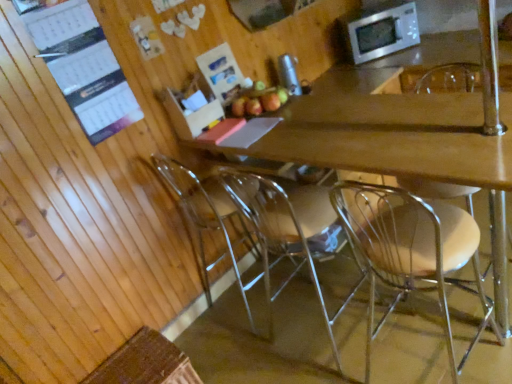
The image size is (512, 384). I want to click on white paper calendar at upper left, so click(81, 65).

This screenshot has height=384, width=512. What do you see at coordinates (396, 139) in the screenshot? I see `wooden desk at center` at bounding box center [396, 139].

You are a GUI agent. You are given a task and a screenshot of the screen. Output one action in this format:
    pyautogui.click(x=<x>, y=<y>)
    Task: Click on the red matte apple at center
    The width and height of the screenshot is (512, 384).
    Given the screenshot: What is the action you would take?
    pyautogui.click(x=258, y=100)

The image size is (512, 384). Describe the element at coordinates (209, 221) in the screenshot. I see `clear plastic chair at lower center, the 4th chair when ordered from right to left` at that location.

Find the location of a particular element. Image resolution: width=512 pixels, height=384 pixels. stainless steel microwave at upper right is located at coordinates (382, 30).

Considering the relative sizes of white paper calendar at upper left and stainless steel microwave at upper right in the image provided, is white paper calendar at upper left shorter than stainless steel microwave at upper right?

Incorrect, the height of white paper calendar at upper left does not fall short of that of stainless steel microwave at upper right.

Considering the sizes of objects white paper calendar at upper left and stainless steel microwave at upper right in the image provided, who is thinner, white paper calendar at upper left or stainless steel microwave at upper right?

white paper calendar at upper left is thinner.

Is white paper calendar at upper left bigger than stainless steel microwave at upper right?

No.

From a real-world perspective, which is physically below, white paper calendar at upper left or stainless steel microwave at upper right?

stainless steel microwave at upper right is physically lower.

From a real-world perspective, between red matte apple at center and clear plastic chair at lower center, the 4th chair when ordered from right to left, who is vertically higher?

From a 3D spatial view, red matte apple at center is above.

Looking at this image, can you confirm if red matte apple at center is positioned to the left of clear plastic chair at lower center, the 4th chair when ordered from right to left?

Incorrect, red matte apple at center is not on the left side of clear plastic chair at lower center, the 4th chair when ordered from right to left.

Between red matte apple at center and clear plastic chair at lower center, the 4th chair when ordered from right to left, which one is positioned in front?

Positioned in front is clear plastic chair at lower center, the 4th chair when ordered from right to left.

Does clear plastic chair at center, the second chair in the right-to-left sequence, have a larger size compared to wooden desk at center?

Incorrect, clear plastic chair at center, the second chair in the right-to-left sequence, is not larger than wooden desk at center.

Are clear plastic chair at center, arranged as the 3th chair when viewed from the left, and wooden desk at center far apart?

No.

From a real-world perspective, between clear plastic chair at center, the second chair in the right-to-left sequence, and wooden desk at center, who is vertically lower?

wooden desk at center, from a real-world perspective.

Is point (457, 213) closer to camera compared to point (495, 156)?

No, (457, 213) is behind (495, 156).

Is stainless steel microwave at upper right not near clear plastic chair at center, which is the 4th chair from left to right?

No, stainless steel microwave at upper right is not far away from clear plastic chair at center, which is the 4th chair from left to right.

Does stainless steel microwave at upper right appear on the right side of clear plastic chair at center, which is the 4th chair from left to right?

No.

The height and width of the screenshot is (384, 512). In order to click on microwave oven above the clear plastic chair at center, which is the 4th chair from left to right (from a real-world perspective) in this screenshot , I will do point(382,30).

How different are the orientations of stainless steel microwave at upper right and clear plastic chair at center, the 1th chair from the right, in degrees?

The facing directions of stainless steel microwave at upper right and clear plastic chair at center, the 1th chair from the right, are 47 degrees apart.

Identify the location of the 1st chair counting from the right of the wooden desk at center. Image resolution: width=512 pixels, height=384 pixels. (411, 252).

Would you say clear plastic chair at center, the second chair in the right-to-left sequence, is part of wooden desk at center's contents?

Absolutely, clear plastic chair at center, the second chair in the right-to-left sequence, is inside wooden desk at center.

Could you measure the distance between wooden desk at center and clear plastic chair at center, the second chair in the right-to-left sequence?

They are 12.07 inches apart.

From the image's perspective, which object appears higher, wooden desk at center or clear plastic chair at center, the second chair in the right-to-left sequence?

From the image's view, wooden desk at center is above.

Does white paper calendar at upper left have a greater height compared to wooden desk at center?

No, white paper calendar at upper left is not taller than wooden desk at center.

From the image's perspective, is white paper calendar at upper left located beneath wooden desk at center?

No, from the image's perspective, white paper calendar at upper left is not beneath wooden desk at center.

Can you confirm if white paper calendar at upper left is thinner than wooden desk at center?

Yes, white paper calendar at upper left is thinner than wooden desk at center.

Is white paper calendar at upper left aimed at wooden desk at center?

No, white paper calendar at upper left is not facing towards wooden desk at center.

Where is `the 3rd chair in front when counting from the red matte apple at center`? the 3rd chair in front when counting from the red matte apple at center is located at coordinates (450, 79).

How many degrees apart are the facing directions of red matte apple at center and clear plastic chair at center, the 1th chair from the right?

The angular difference between red matte apple at center and clear plastic chair at center, the 1th chair from the right, is 89.2 degrees.

Based on the photo, is red matte apple at center wider or thinner than clear plastic chair at center, which is the 4th chair from left to right?

In the image, red matte apple at center appears to be more narrow than clear plastic chair at center, which is the 4th chair from left to right.

Is red matte apple at center in front of clear plastic chair at center, the 1th chair from the right?

No, it is behind clear plastic chair at center, the 1th chair from the right.

In order to click on bulletin board on the left of stainless steel microwave at upper right in this screenshot , I will do `click(81, 65)`.

Image resolution: width=512 pixels, height=384 pixels. Find the location of `apple positioned vertically above the clear plastic chair at lower center, which appears as the first chair when viewed from the left (from a real-world perspective)`. apple positioned vertically above the clear plastic chair at lower center, which appears as the first chair when viewed from the left (from a real-world perspective) is located at coordinates (258, 100).

Looking at the image, which one is located closer to clear acrylic chair at center, acting as the second chair starting from the left, wooden desk at center or clear plastic chair at lower center, which appears as the first chair when viewed from the left?

clear plastic chair at lower center, which appears as the first chair when viewed from the left, is closer to clear acrylic chair at center, acting as the second chair starting from the left.

Looking at this image, looking at the image, which one is located further to clear plastic chair at center, the 1th chair from the right, wooden desk at center or white paper calendar at upper left?

white paper calendar at upper left is positioned further to the anchor clear plastic chair at center, the 1th chair from the right.

From the image, which object appears to be farther from clear acrylic chair at center, arranged as the third chair when viewed from the right, stainless steel microwave at upper right or wooden desk at center?

The object further to clear acrylic chair at center, arranged as the third chair when viewed from the right, is stainless steel microwave at upper right.

Estimate the real-world distances between objects in this image. Which object is closer to clear plastic chair at lower center, which appears as the first chair when viewed from the left, wooden desk at center or clear acrylic chair at center, acting as the second chair starting from the left?

The object closer to clear plastic chair at lower center, which appears as the first chair when viewed from the left, is clear acrylic chair at center, acting as the second chair starting from the left.

Considering their positions, is wooden desk at center positioned further to stainless steel microwave at upper right than clear plastic chair at center, arranged as the 3th chair when viewed from the left?

clear plastic chair at center, arranged as the 3th chair when viewed from the left, lies further to stainless steel microwave at upper right than the other object.

Which object lies further to the anchor point wooden desk at center, stainless steel microwave at upper right or clear plastic chair at lower center, which appears as the first chair when viewed from the left?

Among the two, stainless steel microwave at upper right is located further to wooden desk at center.

Based on their spatial positions, is clear plastic chair at lower center, which appears as the first chair when viewed from the left, or white paper calendar at upper left further from clear plastic chair at center, the 1th chair from the right?

Among the two, white paper calendar at upper left is located further to clear plastic chair at center, the 1th chair from the right.

Which object lies nearer to the anchor point red matte apple at center, stainless steel microwave at upper right or clear plastic chair at center, arranged as the 3th chair when viewed from the left?

A: Among the two, clear plastic chair at center, arranged as the 3th chair when viewed from the left, is located nearer to red matte apple at center.

Image resolution: width=512 pixels, height=384 pixels. I want to click on desk located between clear plastic chair at center, the second chair in the right-to-left sequence, and clear acrylic chair at center, arranged as the third chair when viewed from the right, in the depth direction, so click(396, 139).

Identify the location of apple between white paper calendar at upper left and clear acrylic chair at center, acting as the second chair starting from the left, from left to right. This screenshot has width=512, height=384. (258, 100).

Image resolution: width=512 pixels, height=384 pixels. I want to click on chair situated between white paper calendar at upper left and red matte apple at center from left to right, so click(x=209, y=221).

Locate an element on the screen. apple that lies between stainless steel microwave at upper right and clear plastic chair at lower center, which appears as the first chair when viewed from the left, from top to bottom is located at coordinates (258, 100).